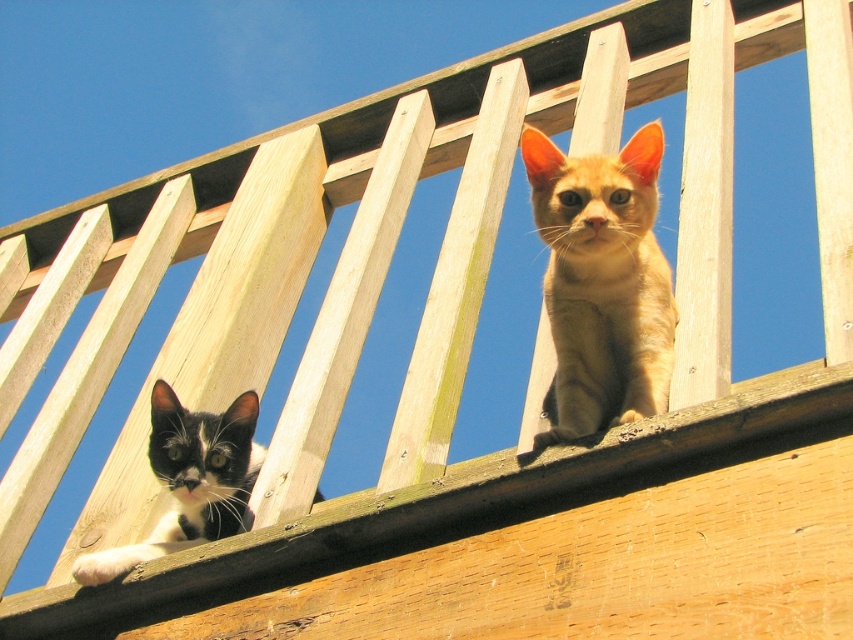
Does golden fur cat at upper right have a greater height compared to black and white fur cat at lower left?

Indeed, golden fur cat at upper right has a greater height compared to black and white fur cat at lower left.

Looking at this image, how far apart are golden fur cat at upper right and black and white fur cat at lower left?

1.93 meters

Is point (630, 396) closer to camera compared to point (160, 467)?

Yes, it is.

This screenshot has height=640, width=853. I want to click on golden fur cat at upper right, so click(601, 284).